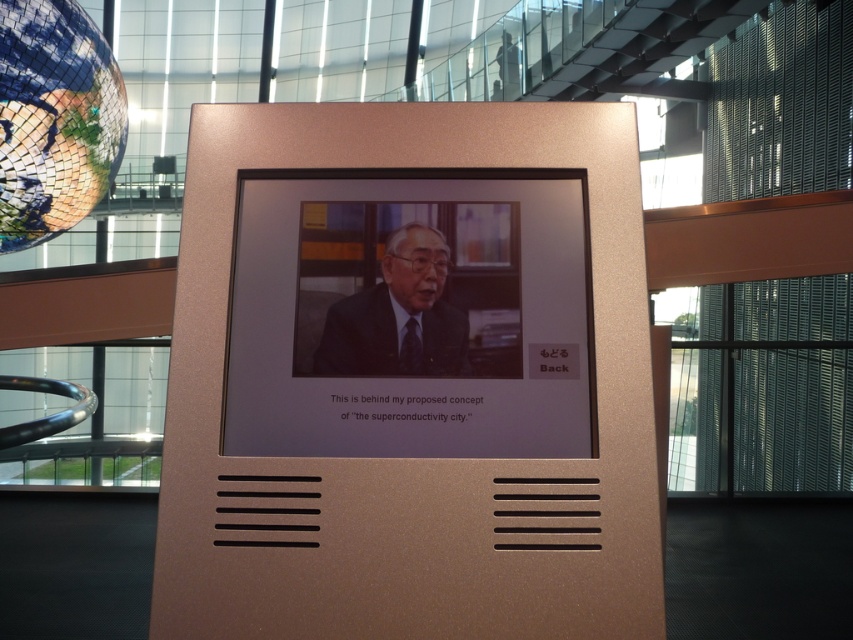
Question: From the image, what is the correct spatial relationship of satin gold frame at center in relation to reflective mosaic globe at upper left?

Choices:
 (A) above
 (B) below

Answer: (B)

Question: Which object is the closest to the dark suit at center?

Choices:
 (A) reflective mosaic globe at upper left
 (B) gold metallic plaque at center
 (C) satin gold frame at center

Answer: (C)

Question: Does satin gold frame at center have a greater width compared to dark suit at center?

Choices:
 (A) no
 (B) yes

Answer: (B)

Question: Is satin gold frame at center positioned before dark suit at center?

Choices:
 (A) yes
 (B) no

Answer: (A)

Question: Which of the following is the closest to the observer?

Choices:
 (A) (560, 376)
 (B) (340, 333)
 (C) (85, 29)
 (D) (415, 515)

Answer: (D)

Question: Considering the real-world distances, which object is closest to the gold metallic plaque at center?

Choices:
 (A) satin gold frame at center
 (B) dark suit at center
 (C) reflective mosaic globe at upper left

Answer: (A)